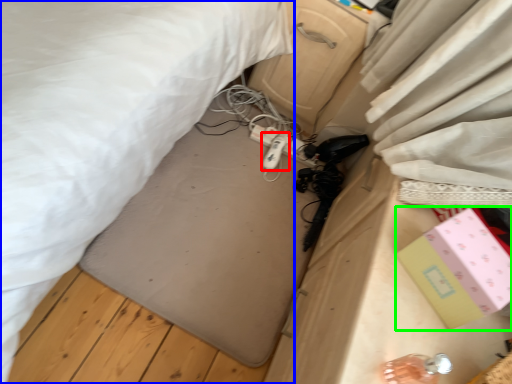
Question: Estimate the real-world distances between objects in this image. Which object is closer to equipment (highlighted by a red box), bed (highlighted by a blue box) or box (highlighted by a green box)?

Choices:
 (A) bed
 (B) box

Answer: (A)